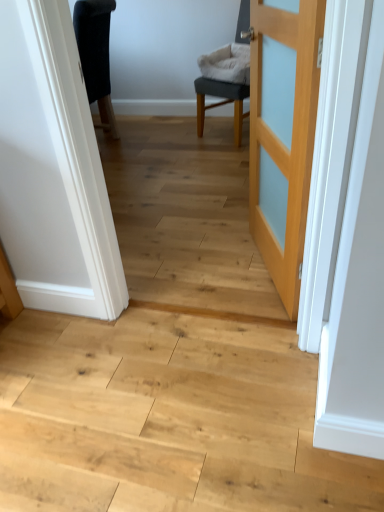
Question: Is light wood door at center looking in the opposite direction of gray fabric chair at center?

Choices:
 (A) no
 (B) yes

Answer: (A)

Question: From a real-world perspective, is light wood door at center on top of gray fabric chair at center?

Choices:
 (A) yes
 (B) no

Answer: (A)

Question: From the image's perspective, is light wood door at center located above gray fabric chair at center?

Choices:
 (A) yes
 (B) no

Answer: (B)

Question: From a real-world perspective, is light wood door at center below gray fabric chair at center?

Choices:
 (A) yes
 (B) no

Answer: (B)

Question: Does light wood door at center have a lesser height compared to gray fabric chair at center?

Choices:
 (A) no
 (B) yes

Answer: (A)

Question: From the image's perspective, is light wood door at center below gray fabric chair at center?

Choices:
 (A) no
 (B) yes

Answer: (B)

Question: From the image's perspective, is gray fabric chair at center under light wood door at center?

Choices:
 (A) yes
 (B) no

Answer: (B)

Question: Is gray fabric chair at center beside light wood door at center?

Choices:
 (A) yes
 (B) no

Answer: (B)

Question: Is gray fabric chair at center positioned behind light wood door at center?

Choices:
 (A) yes
 (B) no

Answer: (A)

Question: Can we say gray fabric chair at center lies outside light wood door at center?

Choices:
 (A) yes
 (B) no

Answer: (A)

Question: Considering the relative sizes of gray fabric chair at center and light wood door at center in the image provided, is gray fabric chair at center bigger than light wood door at center?

Choices:
 (A) yes
 (B) no

Answer: (A)

Question: Is gray fabric chair at center positioned before light wood door at center?

Choices:
 (A) no
 (B) yes

Answer: (A)

Question: Does gray fabric chair at center lie in front of natural wood floor at center?

Choices:
 (A) yes
 (B) no

Answer: (B)